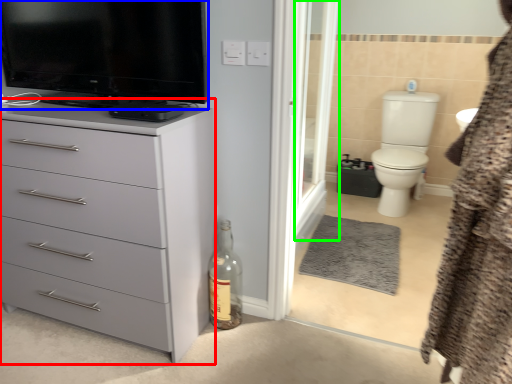
Question: Which object is positioned closest to chest of drawers (highlighted by a red box)? Select from television (highlighted by a blue box) and screen door (highlighted by a green box).

Choices:
 (A) television
 (B) screen door

Answer: (A)